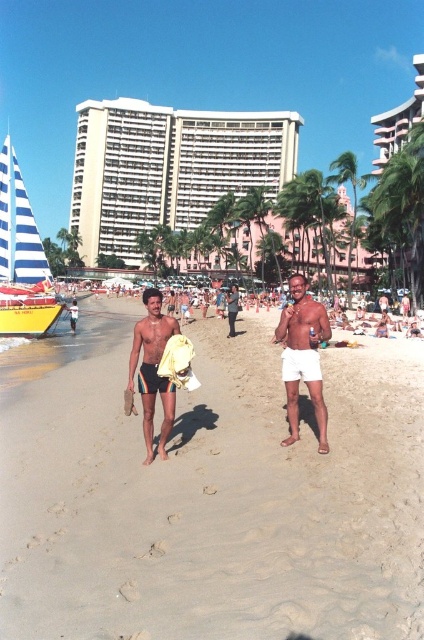
Question: Which point is farther from the camera taking this photo?

Choices:
 (A) (304, 300)
 (B) (290, 358)
 (C) (7, 292)
 (D) (148, 317)

Answer: (C)

Question: Which of the following is the farthest from the observer?

Choices:
 (A) blue striped sailboat at left
 (B) black fabric shorts at center

Answer: (A)

Question: Among these objects, which one is farthest from the camera?

Choices:
 (A) blue striped sailboat at left
 (B) black fabric shorts at center
 (C) white cotton shorts at center-right
 (D) white matte shorts at center

Answer: (A)

Question: Is rainbow striped shorts at center to the left of white cotton shorts at center-right from the viewer's perspective?

Choices:
 (A) yes
 (B) no

Answer: (A)

Question: Is beige sandy beach at center wider than blue striped sailboat at left?

Choices:
 (A) no
 (B) yes

Answer: (A)

Question: Is white matte shorts at center above rainbow striped shorts at center?

Choices:
 (A) no
 (B) yes

Answer: (B)